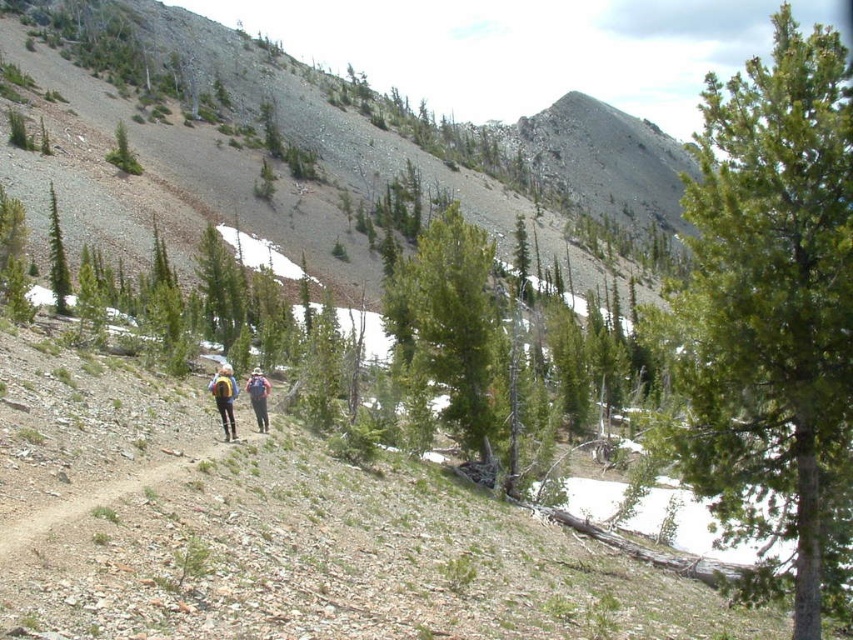
You are a hiker planning to walk along the dirt path at lower center while carrying the blue fabric backpack at center. Considering the path length, will you be able to walk the entire length of the path without needing to adjust your backpack?

The dirt path at lower center is shorter than the blue fabric backpack at center, so the path is not long enough for the backpack. You will need to adjust your backpack before proceeding.